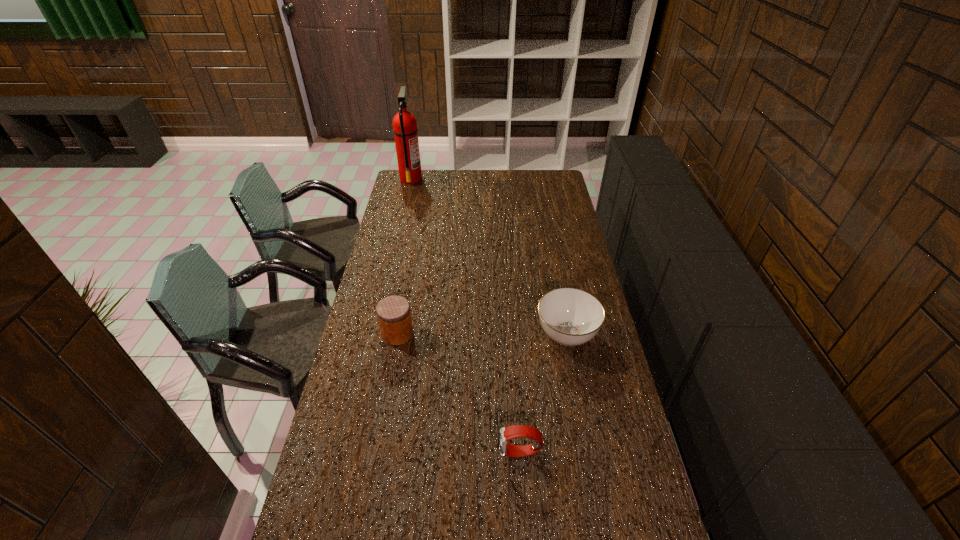
At what (x,y) coordinates should I click in order to perform the action: click on free space that satisfies the following two spatial constraints: 1. on the side of the jar near the handle; 2. on the left side of the farthest object. Please return your answer as a coordinate pair (x, y). The height and width of the screenshot is (540, 960). Looking at the image, I should click on (375, 333).

Identify the location of vacant space that satisfies the following two spatial constraints: 1. on the side of the rightmost object near the handle; 2. on the left side of the farthest object. (375, 335).

The width and height of the screenshot is (960, 540). In order to click on vacant space that satisfies the following two spatial constraints: 1. on the front side of the chinaware; 2. on the face of the nearest object in this screenshot , I will do `click(589, 453)`.

Image resolution: width=960 pixels, height=540 pixels. In order to click on vacant region that satisfies the following two spatial constraints: 1. on the side of the tallest object near the handle; 2. on the back side of the jar in this screenshot , I will do `click(375, 333)`.